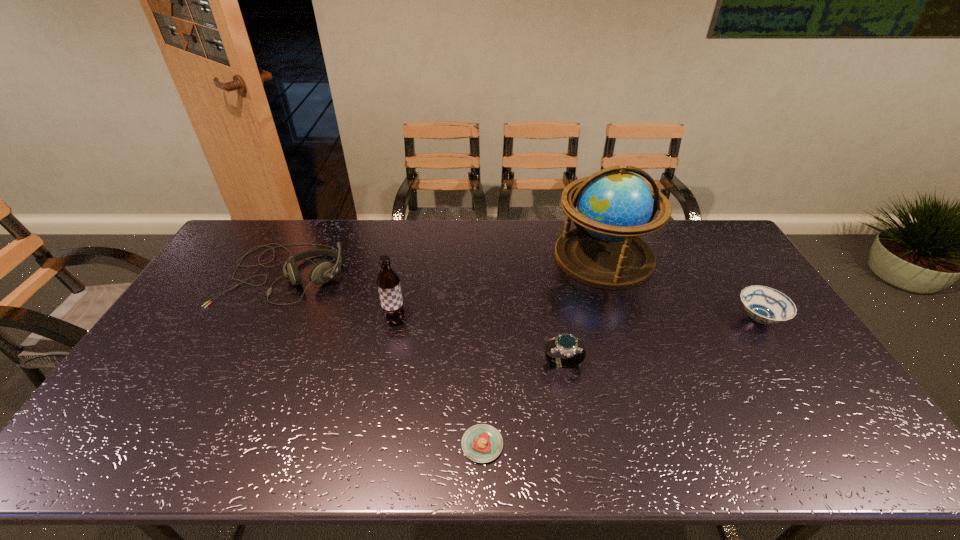
Where is `vacant space positioned 0.120m on the left of the fifth object from right to left`? The width and height of the screenshot is (960, 540). vacant space positioned 0.120m on the left of the fifth object from right to left is located at coordinates (345, 320).

You are a GUI agent. You are given a task and a screenshot of the screen. Output one action in this format:
    pyautogui.click(x=<x>, y=<y>)
    Task: Click on the vacant point located on the outer surface of the leftmost object
    
    Given the screenshot: What is the action you would take?
    pyautogui.click(x=215, y=411)

The height and width of the screenshot is (540, 960). What are the coordinates of `free space located on the back of the fifth farthest object` in the screenshot? It's located at (554, 309).

Locate an element on the screen. The image size is (960, 540). vacant region located 0.300m on the front of the soup bowl is located at coordinates (832, 430).

You are a GUI agent. You are given a task and a screenshot of the screen. Output one action in this format:
    pyautogui.click(x=<x>, y=<y>)
    Task: Click on the vacant area situated on the left of the shortest object
    The width and height of the screenshot is (960, 540).
    Given the screenshot: What is the action you would take?
    pyautogui.click(x=292, y=444)

This screenshot has height=540, width=960. What are the coordinates of `globe that is at the far edge` in the screenshot? It's located at (615, 206).

Locate an element on the screen. headset present at the far edge is located at coordinates (322, 272).

Where is `object at the near edge`? The width and height of the screenshot is (960, 540). object at the near edge is located at coordinates (482, 443).

In order to click on object positioned at the left edge in this screenshot , I will do `click(322, 272)`.

At what (x,y) coordinates should I click in order to perform the action: click on object present at the right edge. Please return your answer as a coordinate pair (x, y). Looking at the image, I should click on (765, 305).